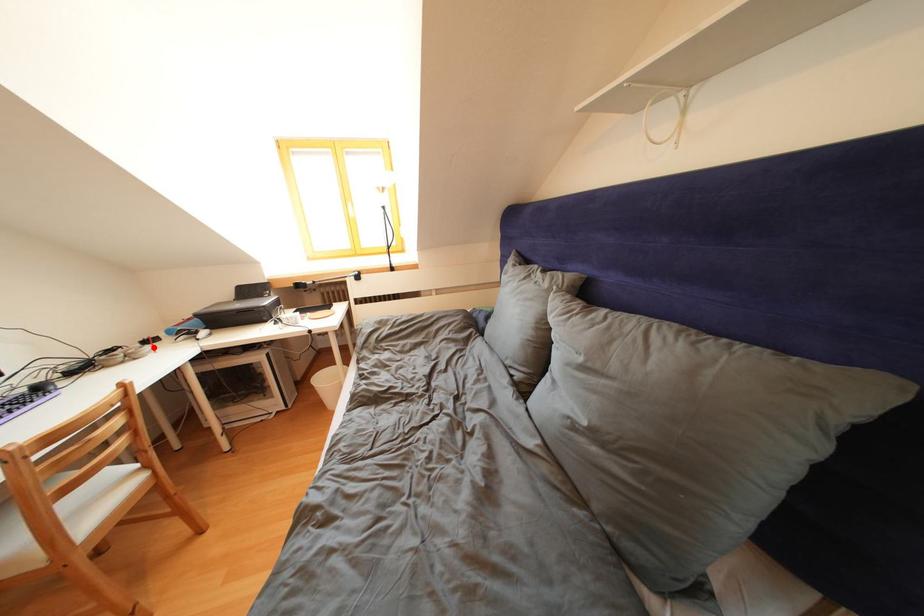
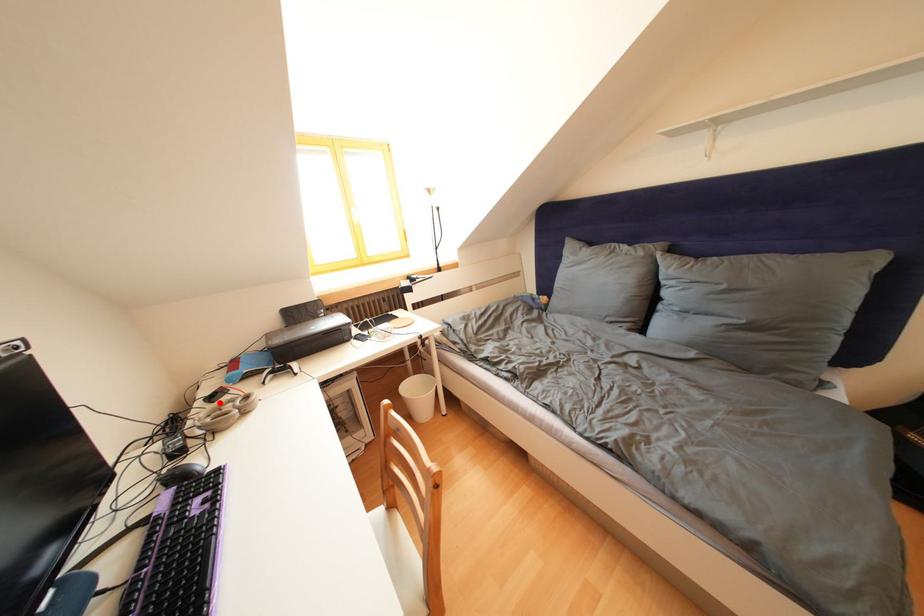
I am providing you with two images of the same scene from different viewpoints. A red point is marked on the first image and another point is marked on the second image. Is the marked point in image1 the same physical position as the marked point in image2?

Yes